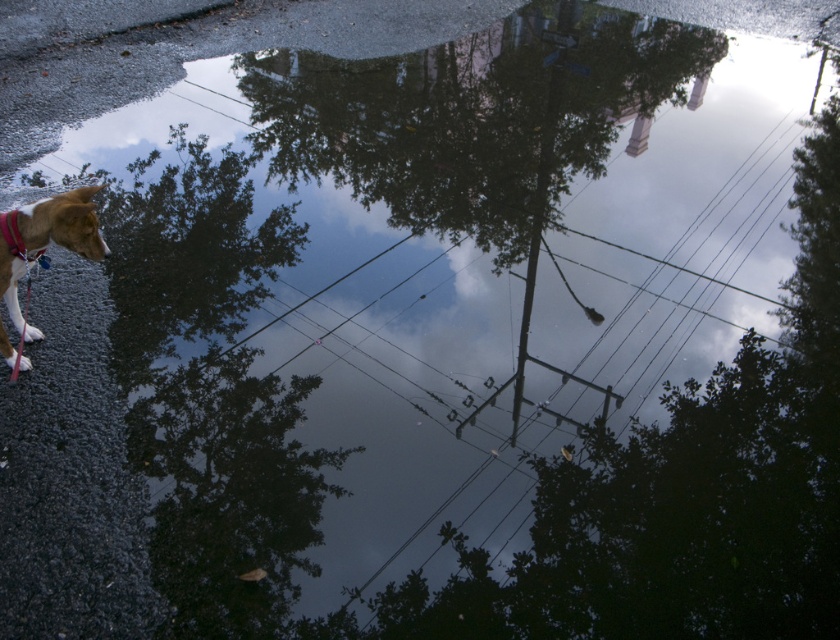
Between point (67, 211) and point (14, 250), which one is positioned behind?

The point (14, 250) is more distant.

Where is `brown fur dog at left`? This screenshot has width=840, height=640. brown fur dog at left is located at coordinates (42, 250).

Who is more distant from viewer, (63, 195) or (18, 232)?

The point (63, 195) is behind.

At what (x,y) coordinates should I click in order to perform the action: click on brown fur dog at left. Please return your answer as a coordinate pair (x, y). This screenshot has height=640, width=840. Looking at the image, I should click on (42, 250).